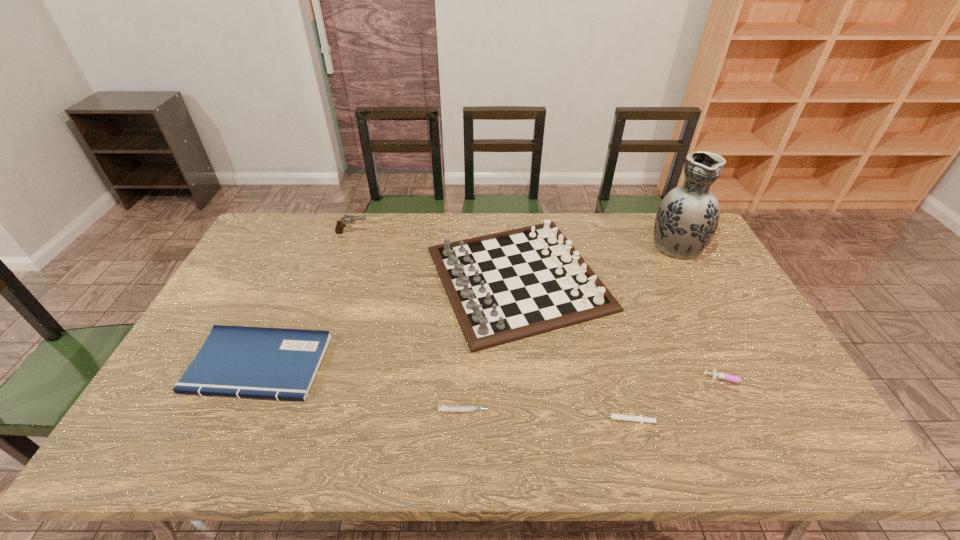
The height and width of the screenshot is (540, 960). What are the coordinates of `free space that satisfies the following two spatial constraints: 1. at the barrel of the farthest syringe; 2. on the right side of the pistol` in the screenshot? It's located at (300, 380).

Where is `vacant space that satisfies the following two spatial constraints: 1. at the barrel of the pistol; 2. on the left side of the rightmost syringe`? The image size is (960, 540). vacant space that satisfies the following two spatial constraints: 1. at the barrel of the pistol; 2. on the left side of the rightmost syringe is located at coordinates (300, 380).